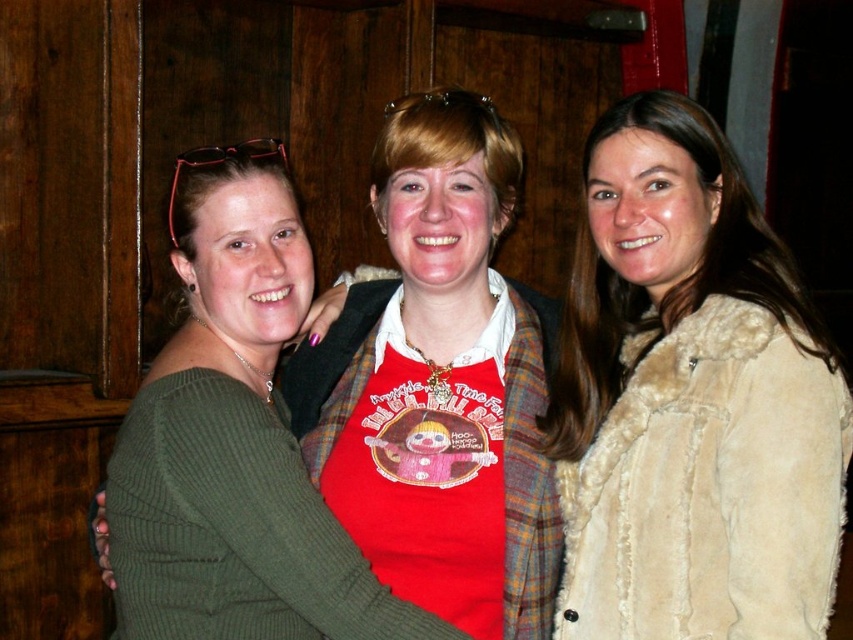
You are a photographer trying to capture a group photo of the three people in the scene. You notice two beige coats hanging on the right side of the group. Which beige coat is closer to the person on the left? Please choose between the beige furry coat at right and the beige fur coat at right.

The beige furry coat at right is positioned on the left side of the beige fur coat at right, so the beige furry coat at right is closer to the person on the left.

You are standing in a bar and want to take a photo of the point at coordinates point (799,522). Your camera has a focal length of 50mm and a sensor size of 24mm. What is the minimum distance you need to be from the point to ensure the entire scene fits in the frame?

The minimum distance required is 1.32 meters, as the point is exactly 1.32 meters away from the viewer.

You are taking a photo of two points in the scene. The first point is at coordinate point (460,417) and the second is at point (618,504). Which point is closer to the camera?

Point (460,417) is closer to the camera than point (618,504) because it is further to the camera than the other point.